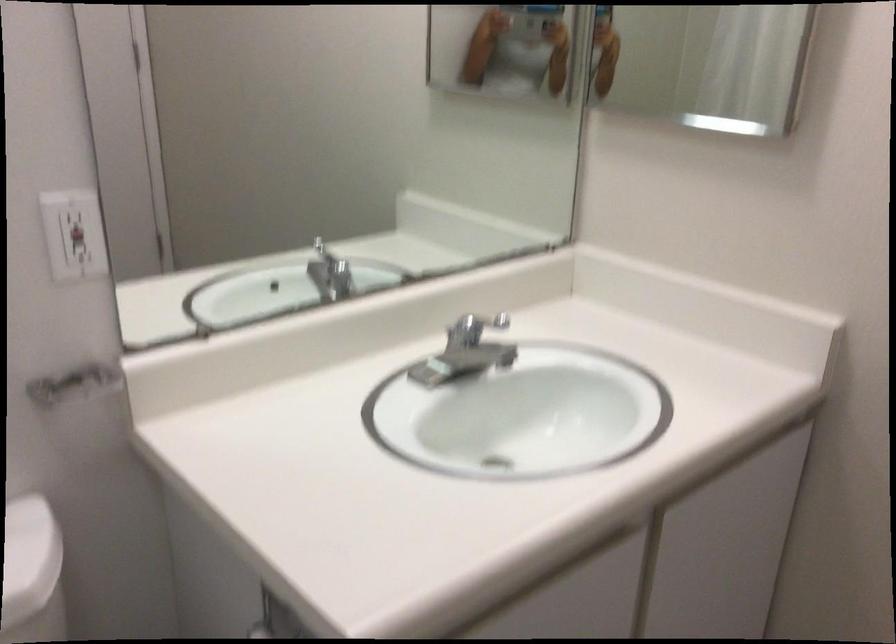
You are a GUI agent. You are given a task and a screenshot of the screen. Output one action in this format:
    pyautogui.click(x=<x>, y=<y>)
    Task: Click on the medicine cabinet handle
    This screenshot has width=896, height=644.
    Given the screenshot: What is the action you would take?
    pyautogui.click(x=259, y=630)